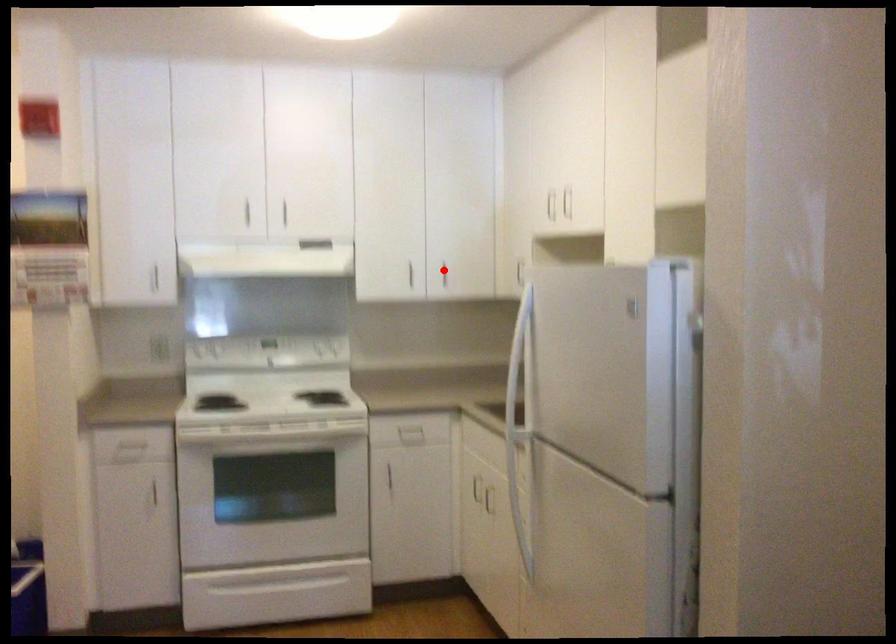
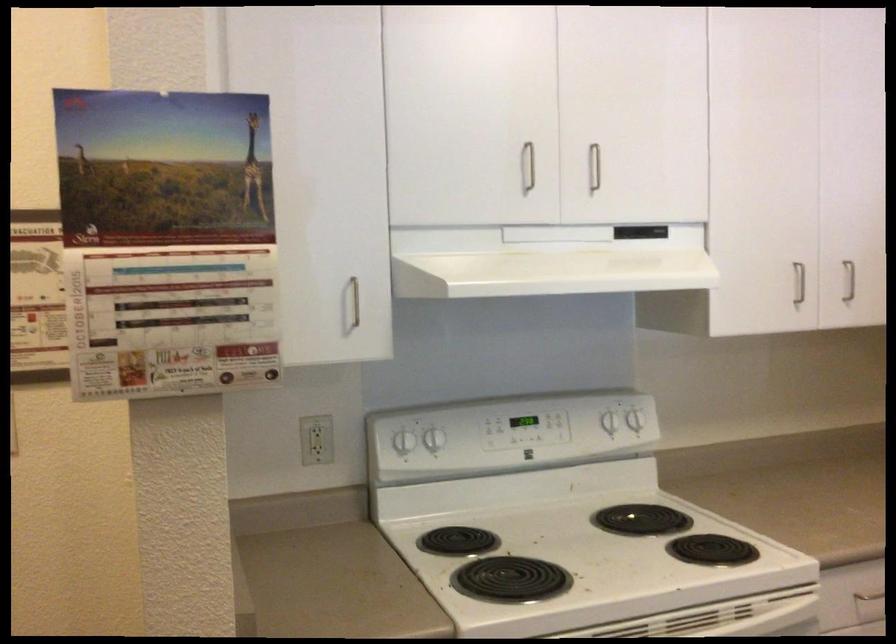
Question: I am providing you with two images of the same scene from different viewpoints. Given a red point in image1, look at the same physical point in image2. Is it:

Choices:
 (A) Closer to the viewpoint
 (B) Farther from the viewpoint

Answer: (A)